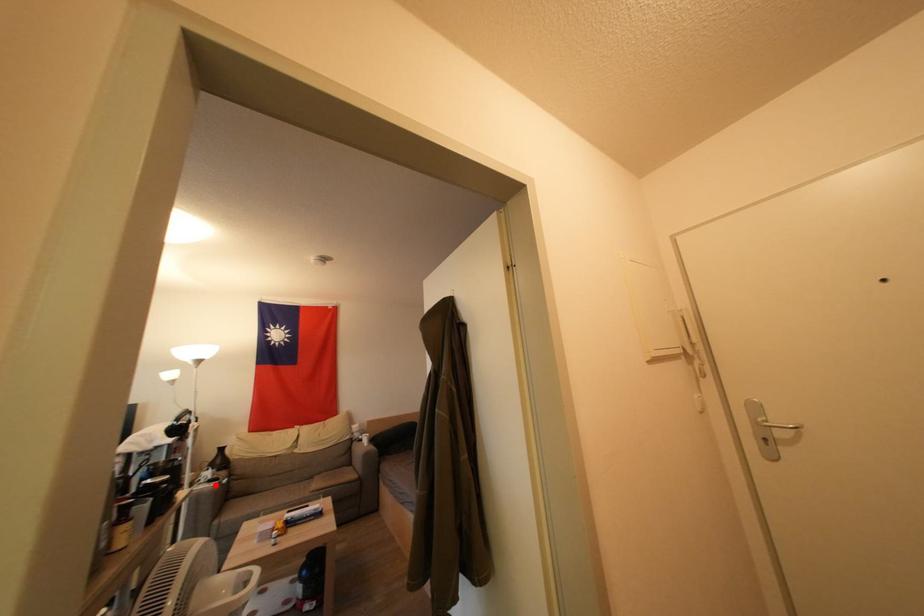
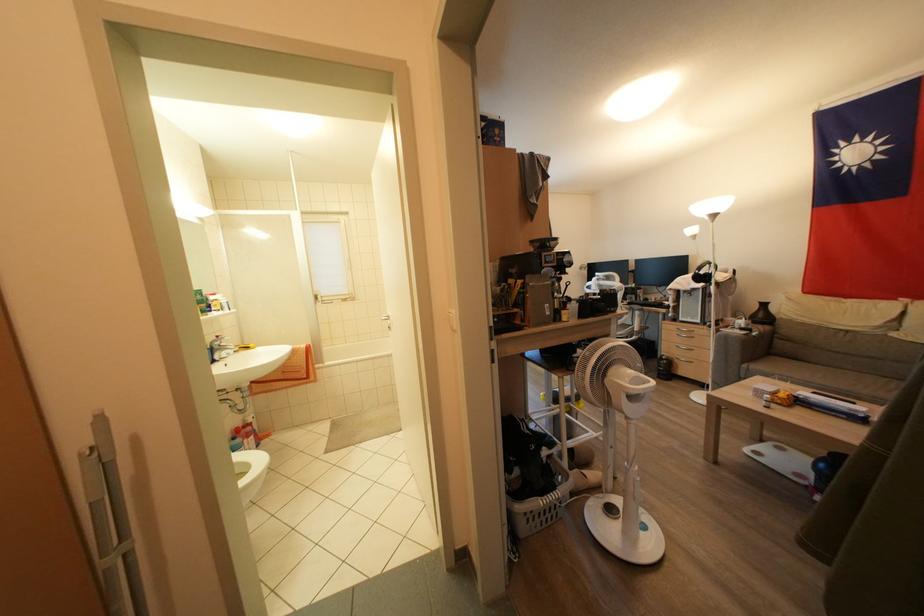
Locate, in the second image, the point that corresponds to the highlighted location in the first image.

(747, 333)